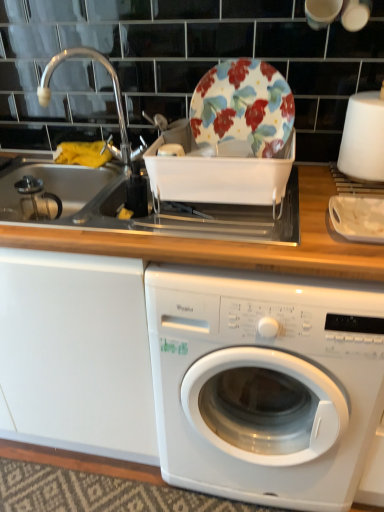
Question: Is white glossy washing machine at center inside or outside of floral-patterned ceramic plate at upper center?

Choices:
 (A) outside
 (B) inside

Answer: (A)

Question: From their relative heights in the image, would you say white glossy washing machine at center is taller or shorter than floral-patterned ceramic plate at upper center?

Choices:
 (A) tall
 (B) short

Answer: (A)

Question: Considering the real-world distances, which object is farthest from the white plastic container at right?

Choices:
 (A) floral-patterned ceramic plate at upper center
 (B) white glossy washing machine at center
 (C) brushed metal sink at left

Answer: (C)

Question: Which object is the closest to the white glossy washing machine at center?

Choices:
 (A) floral-patterned ceramic plate at upper center
 (B) white plastic container at right
 (C) brushed metal sink at left

Answer: (B)